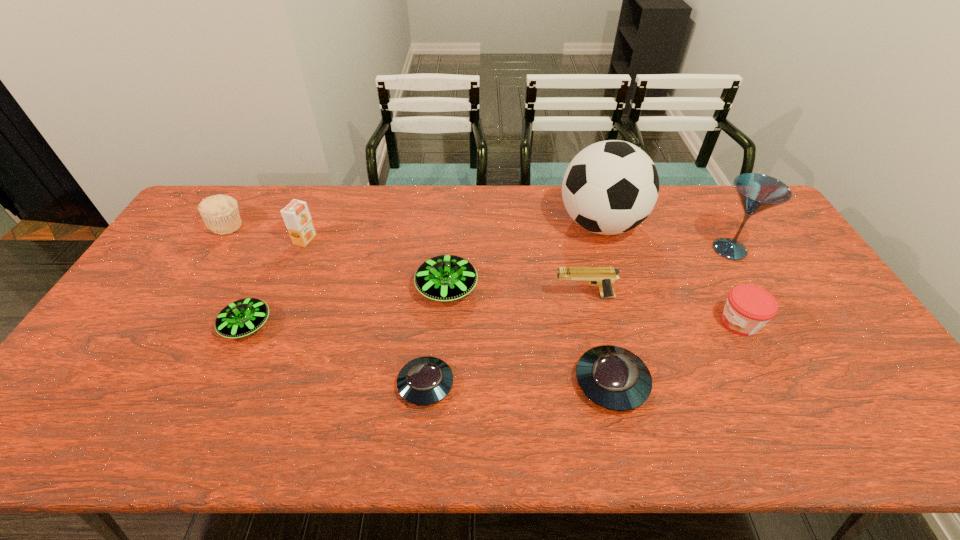
Find the location of `vacant space located on the right of the left gray saucer`. vacant space located on the right of the left gray saucer is located at coordinates (614, 384).

Where is `soccer ball located at the far edge`? The height and width of the screenshot is (540, 960). soccer ball located at the far edge is located at coordinates (610, 187).

At what (x,y) coordinates should I click in order to perform the action: click on muffin positioned at the far edge. Please return your answer as a coordinate pair (x, y). This screenshot has height=540, width=960. Looking at the image, I should click on (220, 213).

This screenshot has height=540, width=960. I want to click on object that is at the near edge, so click(x=614, y=378).

Locate an element on the screen. This screenshot has height=540, width=960. object located in the left edge section of the desktop is located at coordinates (220, 213).

Image resolution: width=960 pixels, height=540 pixels. In order to click on object present at the right edge in this screenshot , I will do `click(757, 192)`.

The image size is (960, 540). Find the location of `object that is at the far left corner`. object that is at the far left corner is located at coordinates [x=220, y=213].

Locate an element on the screen. The height and width of the screenshot is (540, 960). free space at the far edge is located at coordinates (555, 187).

The height and width of the screenshot is (540, 960). Identify the location of vacant space at the near edge of the desktop. tap(141, 448).

Where is `vacant space at the right edge of the desktop`? vacant space at the right edge of the desktop is located at coordinates (834, 334).